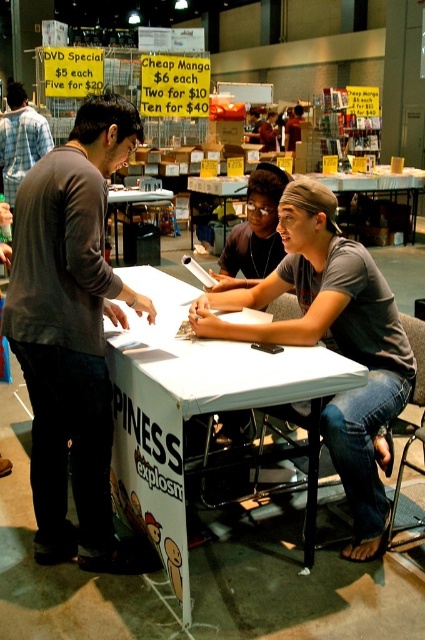
Question: Does white paper at center have a smaller size compared to matte gray shirt at center?

Choices:
 (A) yes
 (B) no

Answer: (B)

Question: Does white paper at center appear on the left side of plaid shirt at left?

Choices:
 (A) no
 (B) yes

Answer: (A)

Question: Is white paper at center to the left of matte gray shirt at center from the viewer's perspective?

Choices:
 (A) yes
 (B) no

Answer: (A)

Question: Which object appears closest to the camera in this image?

Choices:
 (A) matte gray shirt at center
 (B) white paper at center
 (C) dark gray long-sleeve shirt at left

Answer: (B)

Question: Which point is farther to the camera?

Choices:
 (A) (54, 212)
 (B) (374, 365)

Answer: (B)

Question: Which point is closer to the camera?

Choices:
 (A) matte gray shirt at center
 (B) plaid shirt at left
 (C) white paper at center

Answer: (C)